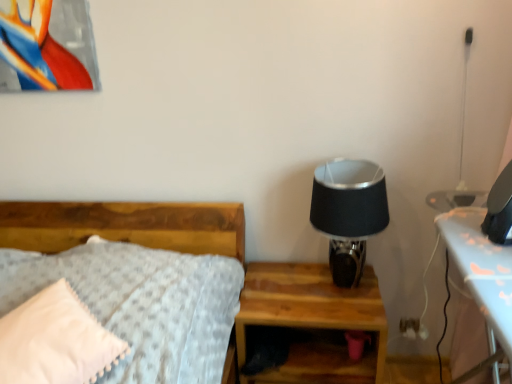
Describe the element at coordinates (410, 327) in the screenshot. This screenshot has height=384, width=512. I see `white plastic electric outlet at lower right` at that location.

In order to face black fabric lampshade at upper right, should I rotate leftwards or rightwards?

You should look right and rotate roughly 12.505 degrees.

Measure the distance between point (x=79, y=364) and camera.

Point (x=79, y=364) and camera are 3.68 feet apart from each other.

You are a GUI agent. You are given a task and a screenshot of the screen. Output one action in this format:
    pyautogui.click(x=<x>, y=<y>)
    Task: Click on the metallic silver picture frame at upper left
    Image resolution: width=512 pixels, height=384 pixels.
    Given the screenshot: What is the action you would take?
    pyautogui.click(x=47, y=46)

Visually, is wooden nightstand at lower right positioned to the left or to the right of black fabric lampshade at upper right?

In the image, wooden nightstand at lower right appears on the left side of black fabric lampshade at upper right.

In terms of width, does wooden nightstand at lower right look wider or thinner when compared to black fabric lampshade at upper right?

Considering their sizes, wooden nightstand at lower right looks broader than black fabric lampshade at upper right.

Can black fabric lampshade at upper right be found inside wooden nightstand at lower right?

No, black fabric lampshade at upper right is not a part of wooden nightstand at lower right.

From the image's perspective, which is above, wooden nightstand at lower right or black fabric lampshade at upper right?

black fabric lampshade at upper right, from the image's perspective.

From the picture: Is white plastic electric outlet at lower right next to wooden nightstand at lower right and touching it?

No, white plastic electric outlet at lower right is not beside wooden nightstand at lower right.

Which of these two, white plastic electric outlet at lower right or wooden nightstand at lower right, is thinner?

white plastic electric outlet at lower right is thinner.

What's the angular difference between white plastic electric outlet at lower right and wooden nightstand at lower right's facing directions?

The angular difference between white plastic electric outlet at lower right and wooden nightstand at lower right is 2.33 degrees.

Which of these two, white plastic electric outlet at lower right or wooden nightstand at lower right, stands shorter?

Standing shorter between the two is white plastic electric outlet at lower right.

Considering the positions of objects black fabric lampshade at upper right and metallic silver picture frame at upper left in the image provided, who is more to the left, black fabric lampshade at upper right or metallic silver picture frame at upper left?

Positioned to the left is metallic silver picture frame at upper left.

From a real-world perspective, between black fabric lampshade at upper right and metallic silver picture frame at upper left, who is vertically higher?

In real-world perspective, metallic silver picture frame at upper left is above.

From the image's perspective, which object appears higher, black fabric lampshade at upper right or metallic silver picture frame at upper left?

metallic silver picture frame at upper left.

Is black fabric lampshade at upper right not near metallic silver picture frame at upper left?

Yes, black fabric lampshade at upper right and metallic silver picture frame at upper left are located far from each other.

Which is in front, point (50, 1) or point (382, 346)?

The point (50, 1) is more forward.

Is metallic silver picture frame at upper left situated inside wooden nightstand at lower right or outside?

metallic silver picture frame at upper left is spatially situated outside wooden nightstand at lower right.

Locate an element on the screen. picture frame on the left of wooden nightstand at lower right is located at coordinates (47, 46).

What's the angular difference between metallic silver picture frame at upper left and wooden nightstand at lower right's facing directions?

0.954 degrees separate the facing orientations of metallic silver picture frame at upper left and wooden nightstand at lower right.

Which is nearer, (101, 332) or (287, 282)?

Point (101, 332)

Is wooden nightstand at lower right located within white soft pillow at left?

No, wooden nightstand at lower right is located outside of white soft pillow at left.

Is white soft pillow at left far away from wooden nightstand at lower right?

No, white soft pillow at left is not far from wooden nightstand at lower right.

Which object is further away from the camera, white plastic electric outlet at lower right or black fabric lampshade at upper right?

white plastic electric outlet at lower right is behind.

From the picture: Is white plastic electric outlet at lower right positioned beyond the bounds of black fabric lampshade at upper right?

white plastic electric outlet at lower right lies outside black fabric lampshade at upper right's area.

Considering the sizes of objects white plastic electric outlet at lower right and black fabric lampshade at upper right in the image provided, who is bigger, white plastic electric outlet at lower right or black fabric lampshade at upper right?

black fabric lampshade at upper right is bigger.

Considering the relative positions of white plastic electric outlet at lower right and black fabric lampshade at upper right in the image provided, is white plastic electric outlet at lower right to the left of black fabric lampshade at upper right from the viewer's perspective?

No.

Is point (37, 54) positioned behind point (22, 334)?

Yes, point (37, 54) is farther from viewer.

Does metallic silver picture frame at upper left have a greater height compared to white soft pillow at left?

Indeed, metallic silver picture frame at upper left has a greater height compared to white soft pillow at left.

Is metallic silver picture frame at upper left looking in the opposite direction of white soft pillow at left?

No, white soft pillow at left is not at the back of metallic silver picture frame at upper left.

Considering the sizes of metallic silver picture frame at upper left and white soft pillow at left in the image, is metallic silver picture frame at upper left wider or thinner than white soft pillow at left?

metallic silver picture frame at upper left is thinner than white soft pillow at left.

I want to click on nightstand that is behind the black fabric lampshade at upper right, so click(x=313, y=322).

Locate an element on the screen. Image resolution: width=512 pixels, height=384 pixels. nightstand above the white plastic electric outlet at lower right (from a real-world perspective) is located at coordinates (313, 322).

Based on their spatial positions, is white plastic electric outlet at lower right or black fabric lampshade at upper right further from wooden nightstand at lower right?

Among the two, white plastic electric outlet at lower right is located further to wooden nightstand at lower right.

Considering their positions, is black fabric lampshade at upper right positioned closer to metallic silver picture frame at upper left than white plastic electric outlet at lower right?

black fabric lampshade at upper right lies closer to metallic silver picture frame at upper left than the other object.

From the image, which object appears to be nearer to wooden nightstand at lower right, metallic silver picture frame at upper left or black fabric lampshade at upper right?

black fabric lampshade at upper right is positioned closer to the anchor wooden nightstand at lower right.

Considering their positions, is metallic silver picture frame at upper left positioned closer to black fabric lampshade at upper right than white plastic electric outlet at lower right?

white plastic electric outlet at lower right is closer to black fabric lampshade at upper right.

Which object lies nearer to the anchor point white plastic electric outlet at lower right, wooden nightstand at lower right or black fabric lampshade at upper right?

wooden nightstand at lower right lies closer to white plastic electric outlet at lower right than the other object.

From the image, which object appears to be farther from white soft pillow at left, metallic silver picture frame at upper left or white plastic electric outlet at lower right?

white plastic electric outlet at lower right is further to white soft pillow at left.

Based on their spatial positions, is white plastic electric outlet at lower right or metallic silver picture frame at upper left further from white soft pillow at left?

white plastic electric outlet at lower right is further to white soft pillow at left.

Estimate the real-world distances between objects in this image. Which object is closer to metallic silver picture frame at upper left, white soft pillow at left or white plastic electric outlet at lower right?

white soft pillow at left.

This screenshot has width=512, height=384. In order to click on pillow situated between metallic silver picture frame at upper left and white plastic electric outlet at lower right from left to right in this screenshot , I will do (x=56, y=340).

This screenshot has width=512, height=384. I want to click on pillow between metallic silver picture frame at upper left and black fabric lampshade at upper right from left to right, so click(56, 340).

Where is `table lamp between metallic silver picture frame at upper left and white plastic electric outlet at lower right from left to right`? The image size is (512, 384). table lamp between metallic silver picture frame at upper left and white plastic electric outlet at lower right from left to right is located at coordinates (348, 213).

Find the location of a particular element. pillow between metallic silver picture frame at upper left and wooden nightstand at lower right vertically is located at coordinates (56, 340).